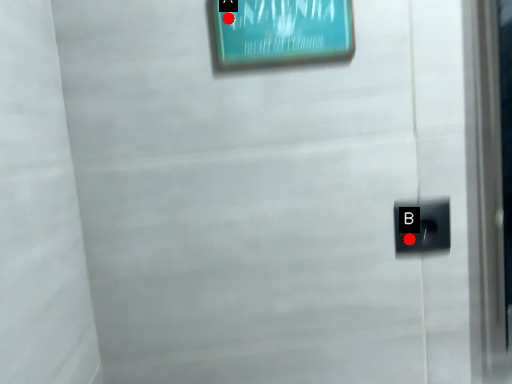
Question: Two points are circled on the image, labeled by A and B beside each circle. Which point is closer to the camera taking this photo?

Choices:
 (A) A is closer
 (B) B is closer

Answer: (A)